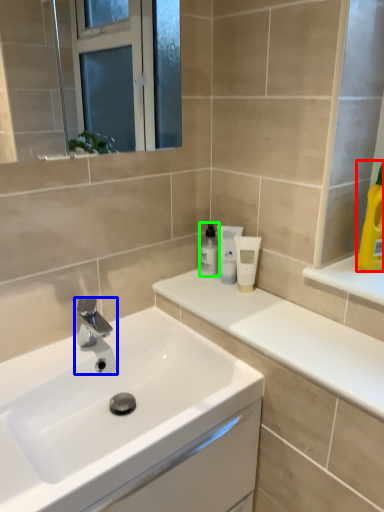
Question: Which object is the farthest from cleaning product (highlighted by a red box)? Choose among these: tap (highlighted by a blue box) or mouthwash (highlighted by a green box).

Choices:
 (A) tap
 (B) mouthwash

Answer: (A)